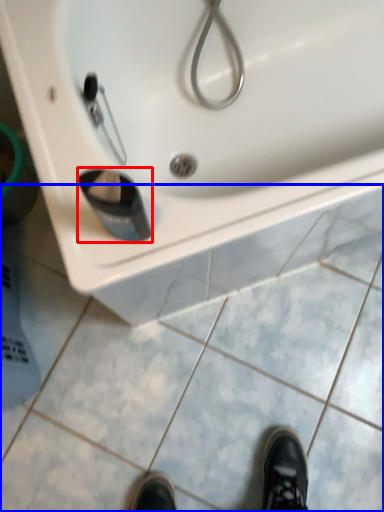
Question: Which object is closer to the camera taking this photo, liquid (highlighted by a red box) or tile (highlighted by a blue box)?

Choices:
 (A) liquid
 (B) tile

Answer: (A)